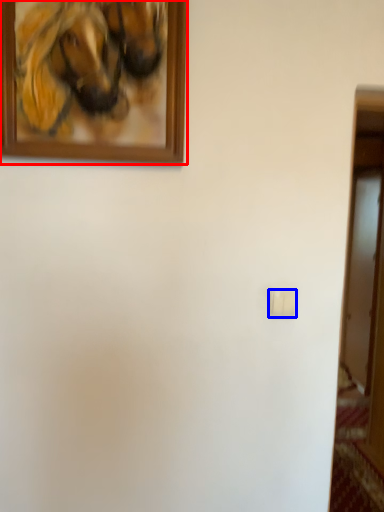
Question: Which object is closer to the camera taking this photo, picture frame (highlighted by a red box) or light switch (highlighted by a blue box)?

Choices:
 (A) picture frame
 (B) light switch

Answer: (A)